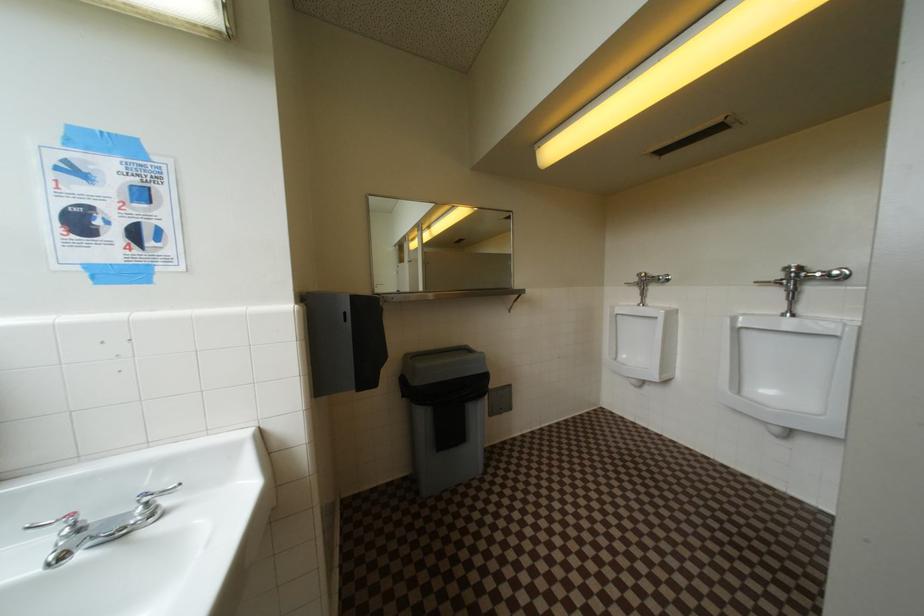
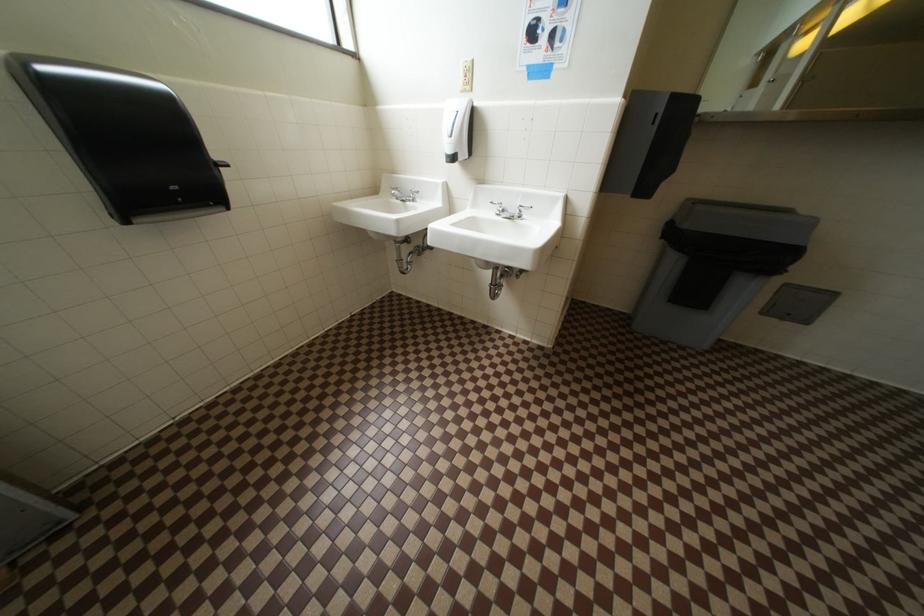
First-person continuous shooting, in which direction is the camera rotating?

The camera's rotation is toward left-down.